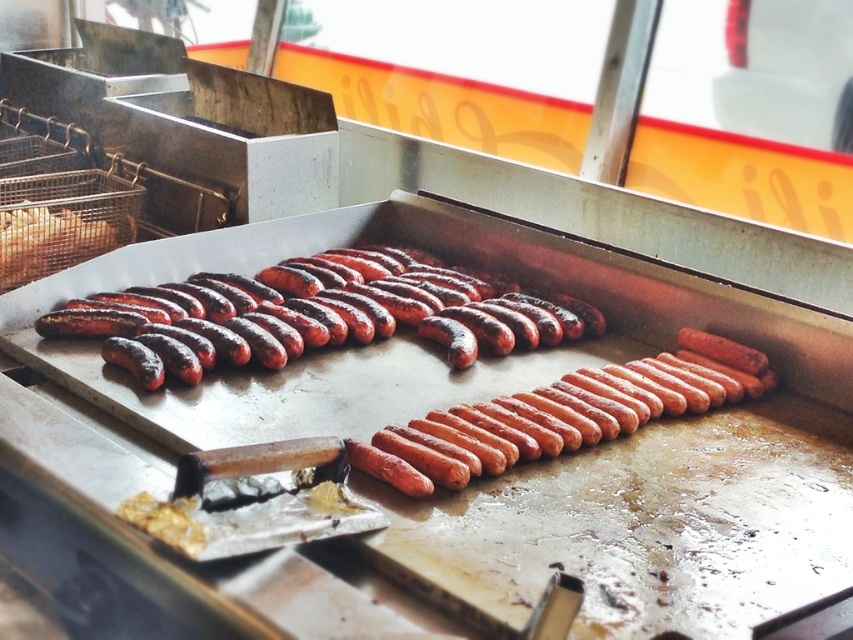
Question: Which object appears closest to the camera in this image?

Choices:
 (A) charred glossy sausages at center
 (B) shiny metallic hot dog at left

Answer: (A)

Question: Does charred glossy sausages at center come behind shiny metallic hot dog at left?

Choices:
 (A) no
 (B) yes

Answer: (A)

Question: Which point is farther from the camera taking this photo?

Choices:
 (A) (132, 218)
 (B) (299, 348)

Answer: (A)

Question: Which point appears farthest from the camera in this image?

Choices:
 (A) (111, 248)
 (B) (590, 330)

Answer: (A)

Question: Does charred glossy sausages at center have a smaller size compared to shiny metallic hot dog at left?

Choices:
 (A) no
 (B) yes

Answer: (A)

Question: Is charred glossy sausages at center to the right of shiny metallic hot dog at left from the viewer's perspective?

Choices:
 (A) yes
 (B) no

Answer: (A)